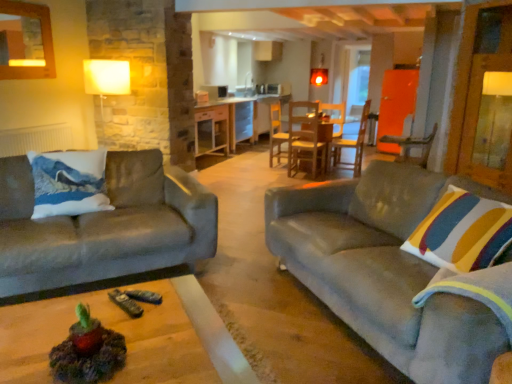
Where is `free space above white matte radiator at left (from a real-world perspective)`? The image size is (512, 384). free space above white matte radiator at left (from a real-world perspective) is located at coordinates (32, 118).